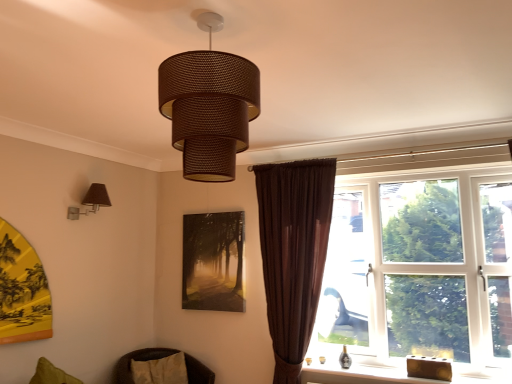
Find the location of a particular element. free location above brown woven lampshade at center, the second lamp from the bottom (from a real-world perspective) is located at coordinates (207, 21).